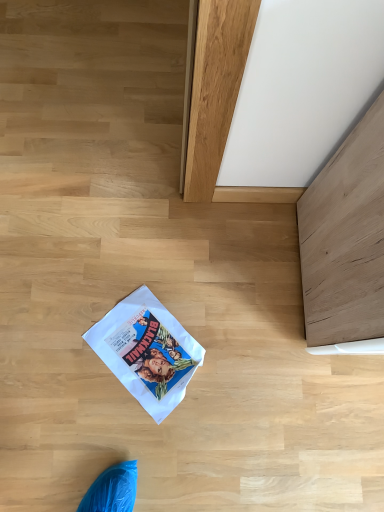
The height and width of the screenshot is (512, 384). I want to click on free point above white paper at center (from a real-world perspective), so click(x=150, y=351).